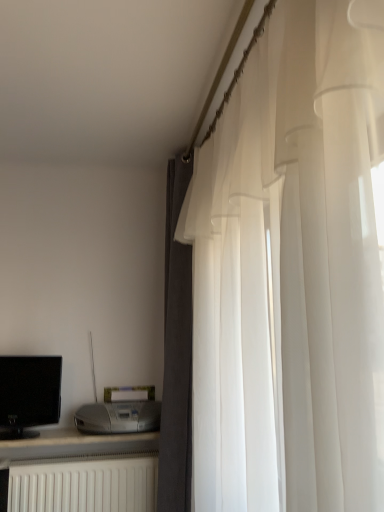
Question: Is white sheer curtain at right, arranged as the second curtain when viewed from the back, in contact with white matte radiator at lower left?

Choices:
 (A) no
 (B) yes

Answer: (A)

Question: Does white sheer curtain at right, the 1th curtain in the front-to-back sequence, have a lesser width compared to white matte radiator at lower left?

Choices:
 (A) yes
 (B) no

Answer: (B)

Question: Does white sheer curtain at right, the 1th curtain in the front-to-back sequence, have a lesser height compared to white matte radiator at lower left?

Choices:
 (A) yes
 (B) no

Answer: (B)

Question: Considering the relative positions of white sheer curtain at right, arranged as the second curtain when viewed from the back, and white matte radiator at lower left in the image provided, is white sheer curtain at right, arranged as the second curtain when viewed from the back, to the right of white matte radiator at lower left from the viewer's perspective?

Choices:
 (A) no
 (B) yes

Answer: (B)

Question: Can you confirm if white sheer curtain at right, arranged as the second curtain when viewed from the back, is taller than white matte radiator at lower left?

Choices:
 (A) yes
 (B) no

Answer: (A)

Question: From a real-world perspective, is white sheer curtain at right, arranged as the second curtain when viewed from the back, on top of white matte radiator at lower left?

Choices:
 (A) yes
 (B) no

Answer: (A)

Question: Does white sheer curtain at right, arranged as the second curtain when viewed from the back, appear on the left side of satin silver printer at lower left?

Choices:
 (A) no
 (B) yes

Answer: (A)

Question: Is white sheer curtain at right, the 1th curtain in the front-to-back sequence, in contact with satin silver printer at lower left?

Choices:
 (A) yes
 (B) no

Answer: (B)

Question: Does white sheer curtain at right, the 1th curtain in the front-to-back sequence, have a lesser width compared to satin silver printer at lower left?

Choices:
 (A) yes
 (B) no

Answer: (A)

Question: Does white sheer curtain at right, arranged as the second curtain when viewed from the back, have a larger size compared to satin silver printer at lower left?

Choices:
 (A) yes
 (B) no

Answer: (A)

Question: Is white sheer curtain at right, the 1th curtain in the front-to-back sequence, at the right side of satin silver printer at lower left?

Choices:
 (A) yes
 (B) no

Answer: (A)

Question: Is black glossy computer monitor at left looking in the opposite direction of dark gray fabric curtain at right, which is counted as the 1th curtain, starting from the back?

Choices:
 (A) yes
 (B) no

Answer: (B)